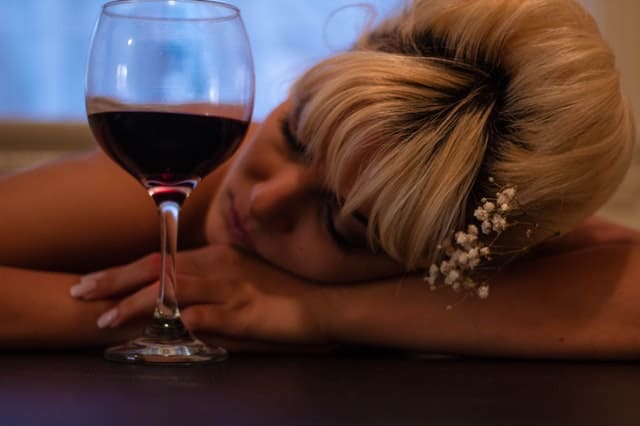
The image size is (640, 426). In order to click on wineglass stem in this screenshot , I will do `click(166, 241)`.